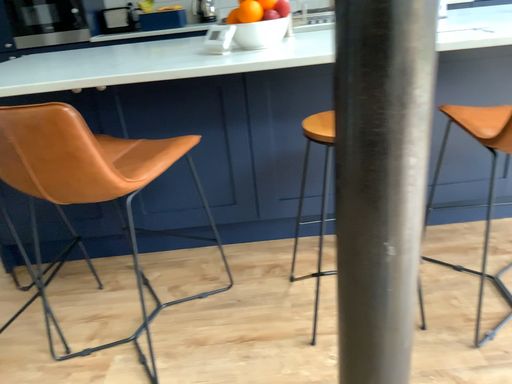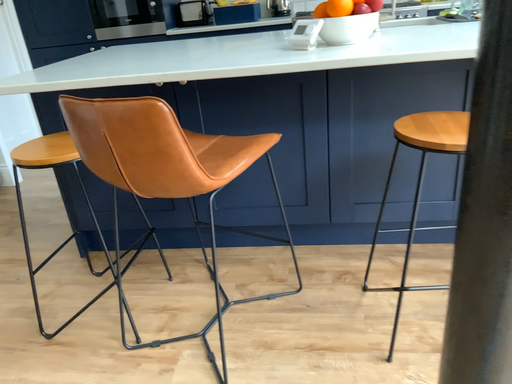
Question: How did the camera likely rotate when shooting the video?

Choices:
 (A) rotated right
 (B) rotated left

Answer: (B)